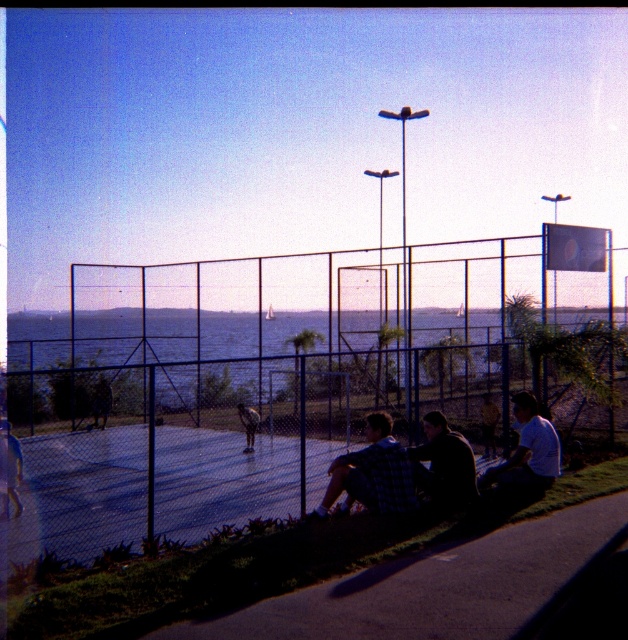
Looking at this image, how far apart are blue wire mesh fence at center and smooth asphalt pavement at lower center?

blue wire mesh fence at center is 18.02 meters from smooth asphalt pavement at lower center.

Which is behind, point (268, 396) or point (474, 628)?

Point (268, 396)

Describe the element at coordinates (279, 381) in the screenshot. I see `blue wire mesh fence at center` at that location.

Locate an element on the screen. Image resolution: width=628 pixels, height=640 pixels. blue wire mesh fence at center is located at coordinates (279, 381).

Is dark blue shirt at lower center above light blue shirt at lower right?

Actually, dark blue shirt at lower center is below light blue shirt at lower right.

Is point (425, 484) closer to viewer compared to point (517, 464)?

That is True.

The width and height of the screenshot is (628, 640). I want to click on dark blue shirt at lower center, so click(x=443, y=461).

Does blue wire mesh fence at center have a lesser width compared to dark blue shirt at lower center?

In fact, blue wire mesh fence at center might be wider than dark blue shirt at lower center.

Is point (284, 401) less distant than point (441, 429)?

No, (284, 401) is behind (441, 429).

At what (x,y) coordinates should I click in order to perform the action: click on blue wire mesh fence at center. Please return your answer as a coordinate pair (x, y). This screenshot has width=628, height=640. Looking at the image, I should click on (279, 381).